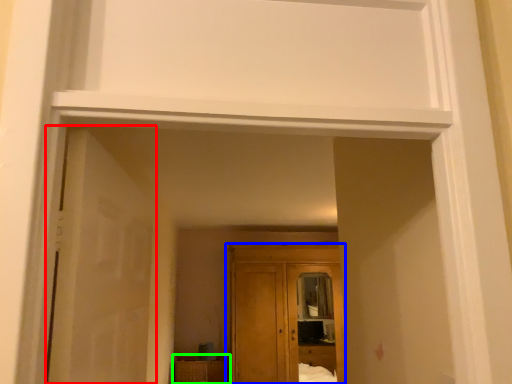
Question: Which object is positioned closest to door (highlighted by a red box)? Select from cupboard (highlighted by a blue box) and cabinetry (highlighted by a green box).

Choices:
 (A) cupboard
 (B) cabinetry

Answer: (A)